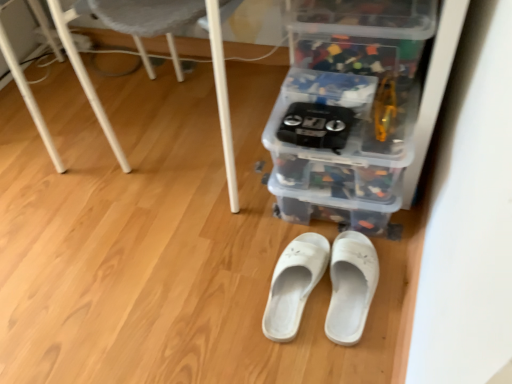
Question: Which direction should I rotate to look at white fabric slippers at center, the 1th footwear from the left?

Choices:
 (A) right
 (B) left

Answer: (A)

Question: From the image's perspective, is white plastic chair at lower center located beneath white fabric slipper at center, which is the first footwear from right to left?

Choices:
 (A) no
 (B) yes

Answer: (A)

Question: Is white plastic chair at lower center located outside white fabric slipper at center, the 2th footwear positioned from the left?

Choices:
 (A) no
 (B) yes

Answer: (B)

Question: Does white plastic chair at lower center have a greater height compared to white fabric slipper at center, which is the first footwear from right to left?

Choices:
 (A) no
 (B) yes

Answer: (B)

Question: Is white fabric slipper at center, which is the first footwear from right to left, at the back of white plastic chair at lower center?

Choices:
 (A) no
 (B) yes

Answer: (A)

Question: Is the surface of white plastic chair at lower center in direct contact with white fabric slipper at center, which is the first footwear from right to left?

Choices:
 (A) yes
 (B) no

Answer: (B)

Question: Is white plastic chair at lower center behind white fabric slipper at center, which is the first footwear from right to left?

Choices:
 (A) yes
 (B) no

Answer: (B)

Question: Is translucent plastic storage box at center, the 1th storage box in the top-to-bottom sequence, next to transparent plastic storage box at center, which is the second storage box in top-to-bottom order, and touching it?

Choices:
 (A) yes
 (B) no

Answer: (B)

Question: From a real-world perspective, is translucent plastic storage box at center, the 3th storage box in the bottom-to-top sequence, positioned under transparent plastic storage box at center, the 2th storage box positioned from the bottom, based on gravity?

Choices:
 (A) no
 (B) yes

Answer: (A)

Question: Does translucent plastic storage box at center, the 1th storage box in the top-to-bottom sequence, have a larger size compared to transparent plastic storage box at center, which is the second storage box in top-to-bottom order?

Choices:
 (A) yes
 (B) no

Answer: (B)

Question: Does translucent plastic storage box at center, the 1th storage box in the top-to-bottom sequence, have a greater height compared to transparent plastic storage box at center, which is the second storage box in top-to-bottom order?

Choices:
 (A) no
 (B) yes

Answer: (A)

Question: Is translucent plastic storage box at center, the 3th storage box in the bottom-to-top sequence, positioned in front of transparent plastic storage box at center, the 2th storage box positioned from the bottom?

Choices:
 (A) no
 (B) yes

Answer: (A)

Question: Is translucent plastic storage box at center, the 1th storage box in the top-to-bottom sequence, not inside transparent plastic storage box at center, which is the second storage box in top-to-bottom order?

Choices:
 (A) no
 (B) yes

Answer: (B)

Question: Is translucent plastic storage box at center, the 3th storage box in the bottom-to-top sequence, touching white fabric slippers at center, the 1th footwear from the left?

Choices:
 (A) no
 (B) yes

Answer: (A)